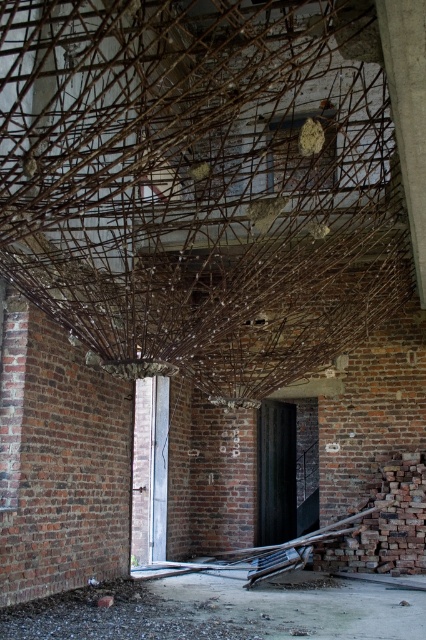
Question: Does brown textured branch at center have a greater width compared to smooth concrete pillar at upper right?

Choices:
 (A) yes
 (B) no

Answer: (B)

Question: Does brown textured branch at center appear on the right side of smooth concrete pillar at upper right?

Choices:
 (A) no
 (B) yes

Answer: (A)

Question: Which point appears farthest from the camera in this image?

Choices:
 (A) (14, 49)
 (B) (389, 68)

Answer: (B)

Question: Can you confirm if brown textured branch at center is positioned below smooth concrete pillar at upper right?

Choices:
 (A) no
 (B) yes

Answer: (B)

Question: Which point appears farthest from the camera in this image?

Choices:
 (A) (207, 220)
 (B) (380, 26)

Answer: (A)

Question: Among these objects, which one is nearest to the camera?

Choices:
 (A) brown textured branch at center
 (B) smooth concrete pillar at upper right

Answer: (B)